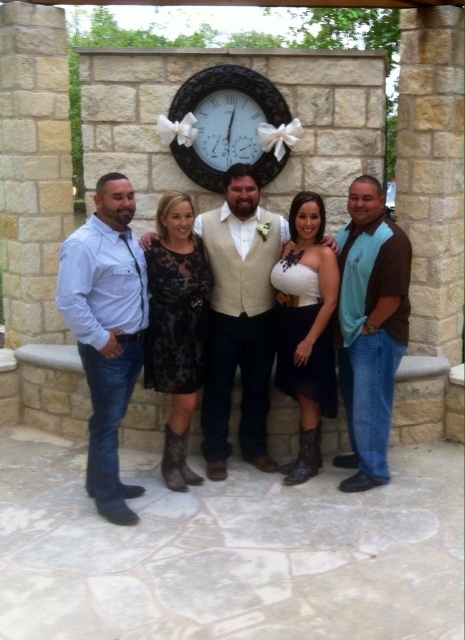
You are a photographer setting up for a group photo. You notice a matte white dress at center located at point (119, 339). Where should you position your camera to ensure the dress is centered in the frame?

Position the camera so that its lens is aligned with the coordinates (119, 339) to center the matte white dress at center in the frame.

You are standing in front of the stone wall with the ornate clock. There are two points marked on the wall at coordinates point (259, 385) and point (188, 150). Which point is closer to you?

Point (259, 385) is closer to the viewer than point (188, 150).